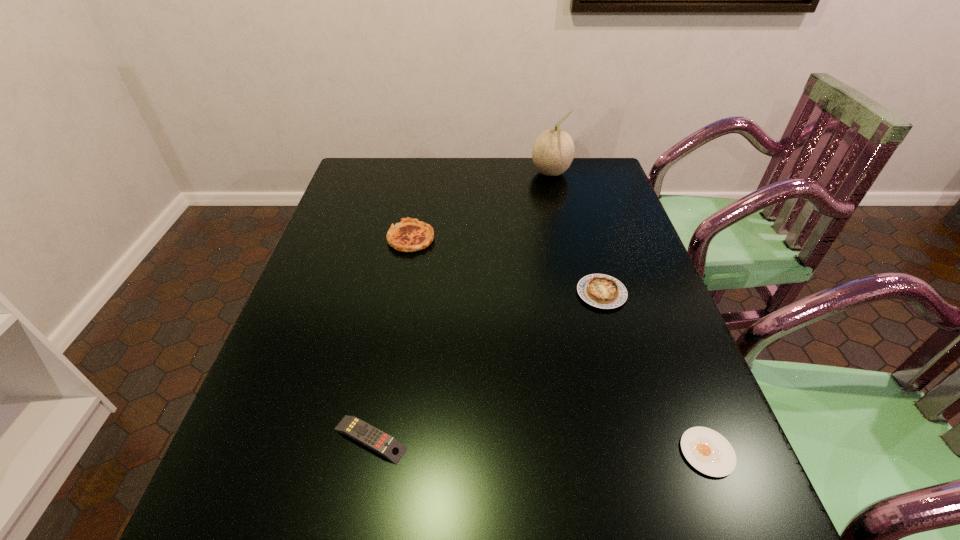
Find the location of a particular element. vacant area that lies between the egg yolk and the cantaloup is located at coordinates (629, 313).

The width and height of the screenshot is (960, 540). What are the coordinates of `vacant region between the remote control and the second tallest object` in the screenshot? It's located at (391, 339).

Where is `empty location between the remote control and the taller quiche`? The height and width of the screenshot is (540, 960). empty location between the remote control and the taller quiche is located at coordinates (391, 339).

At what (x,y) coordinates should I click in order to perform the action: click on object identified as the fourth closest to the egg yolk. Please return your answer as a coordinate pair (x, y). This screenshot has width=960, height=540. Looking at the image, I should click on (553, 151).

Locate an element on the screen. object that is the fourth closest to the farther quiche is located at coordinates (709, 452).

The width and height of the screenshot is (960, 540). I want to click on free location that satisfies the following two spatial constraints: 1. on the back side of the fourth shortest object; 2. on the left side of the farthest object, so click(423, 173).

This screenshot has width=960, height=540. I want to click on vacant space that satisfies the following two spatial constraints: 1. on the back side of the cantaloup; 2. on the right side of the second shortest object, so click(x=420, y=173).